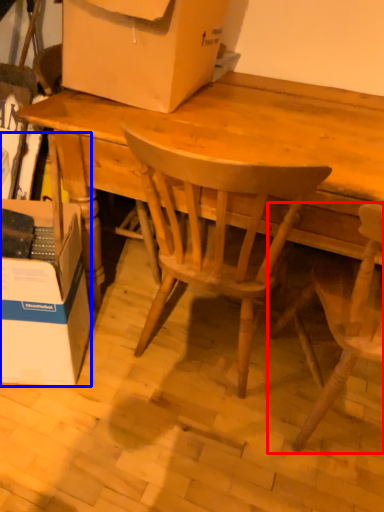
Question: Which point is further to the camera, chair (highlighted by a red box) or box (highlighted by a blue box)?

Choices:
 (A) chair
 (B) box

Answer: (B)